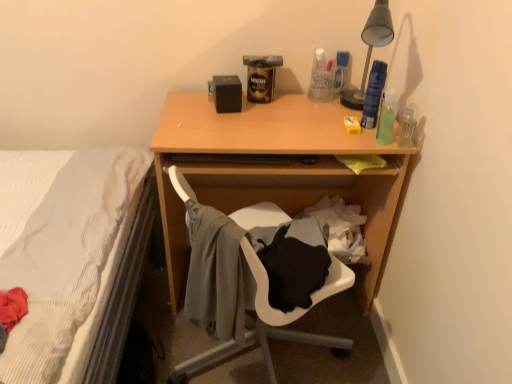
Where is `vacant position to the left of clear plastic bottle at right, the second bottle from the front`? The height and width of the screenshot is (384, 512). vacant position to the left of clear plastic bottle at right, the second bottle from the front is located at coordinates (348, 132).